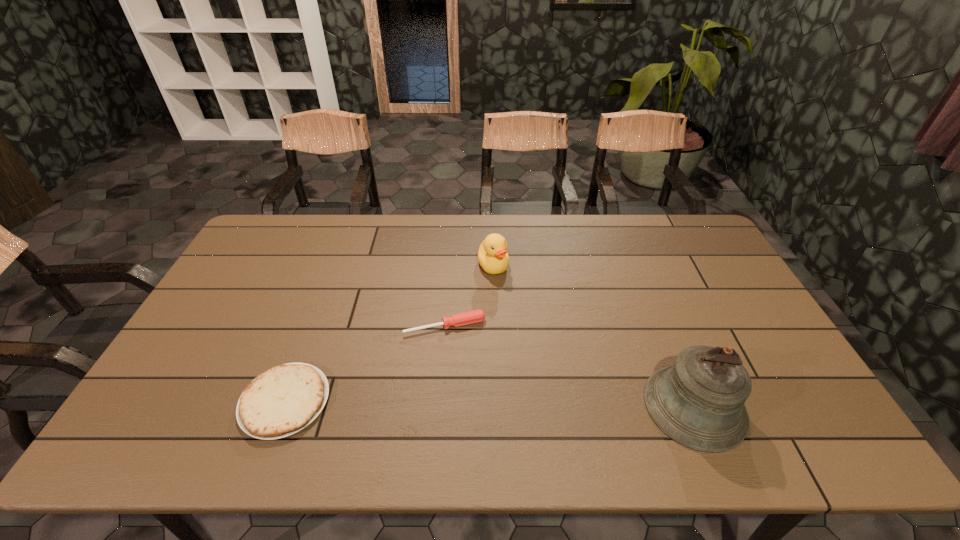
This screenshot has height=540, width=960. I want to click on tortilla, so click(283, 400).

Identify the location of bell. (698, 401).

Where is `the tallest object`? This screenshot has width=960, height=540. the tallest object is located at coordinates (698, 401).

Image resolution: width=960 pixels, height=540 pixels. Identify the location of duck. (492, 255).

This screenshot has width=960, height=540. In order to click on the second tallest object in this screenshot , I will do `click(492, 255)`.

The image size is (960, 540). In order to click on screwdriver in this screenshot , I will do `click(476, 316)`.

At what (x,y) coordinates should I click in order to perform the action: click on vacant space located 0.220m on the back of the tortilla. Please return your answer as a coordinate pair (x, y). Image resolution: width=960 pixels, height=540 pixels. Looking at the image, I should click on (321, 306).

Find the location of a particular element. This screenshot has width=960, height=540. free space located on the left of the bell is located at coordinates (536, 407).

Locate an element on the screen. Image resolution: width=960 pixels, height=540 pixels. vacant space located 0.080m at the beak of the farthest object is located at coordinates pyautogui.click(x=503, y=296).

What are the coordinates of `vacant space located at the beak of the farthest object` in the screenshot? It's located at (516, 332).